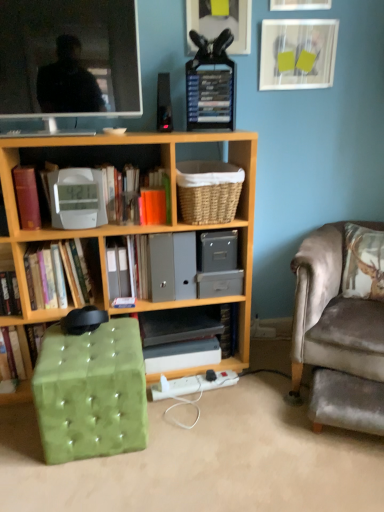
I want to click on free space in front of green tufted ottoman at lower left, so click(x=96, y=483).